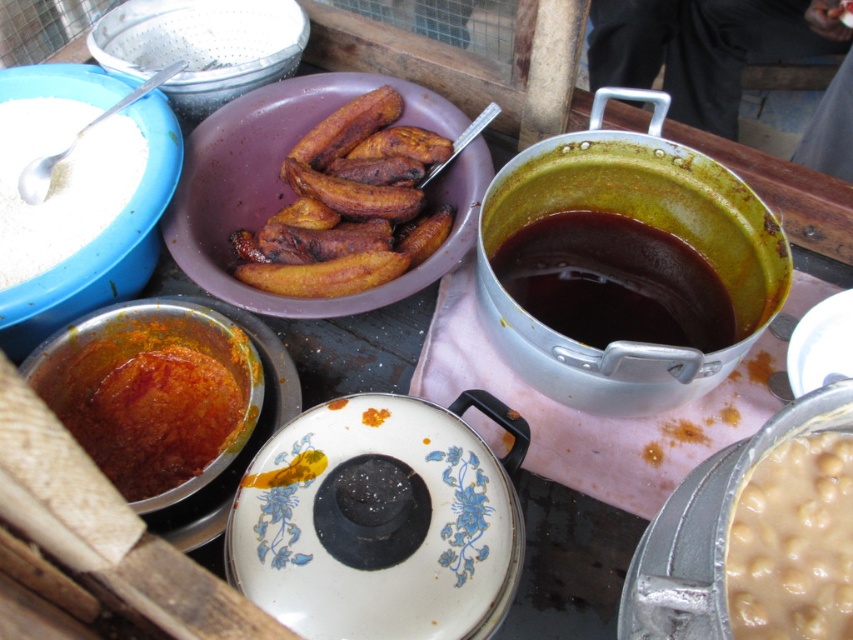
You are a customer at this food stall and want to ask the vendor where the creamy beige beans at center are in relation to the brushed metal strainer at upper left. Based on the scene, how would the vendor describe their positions?

The creamy beige beans at center are located below the brushed metal strainer at upper left.

You are a customer at the food stall and want to grab both the thick orange paste at center left and the brown matte plantains at center. Which item will you need to reach over first?

You will need to reach over the thick orange paste at center left first because it is closer to you than the brown matte plantains at center.